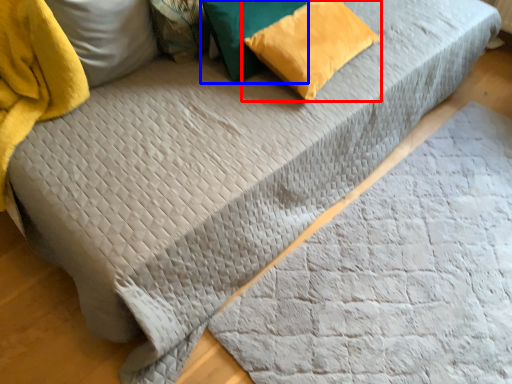
Question: Which object is closer to the camera taking this photo, pillow (highlighted by a red box) or pillow (highlighted by a blue box)?

Choices:
 (A) pillow
 (B) pillow

Answer: (B)